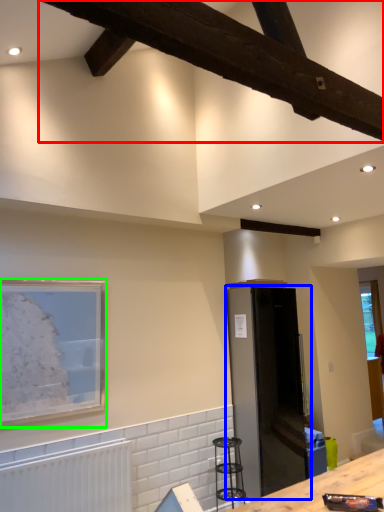
Question: Considering the real-world distances, which object is farthest from exhaust hood (highlighted by a red box)? appliance (highlighted by a blue box) or picture frame (highlighted by a green box)?

Choices:
 (A) appliance
 (B) picture frame

Answer: (A)